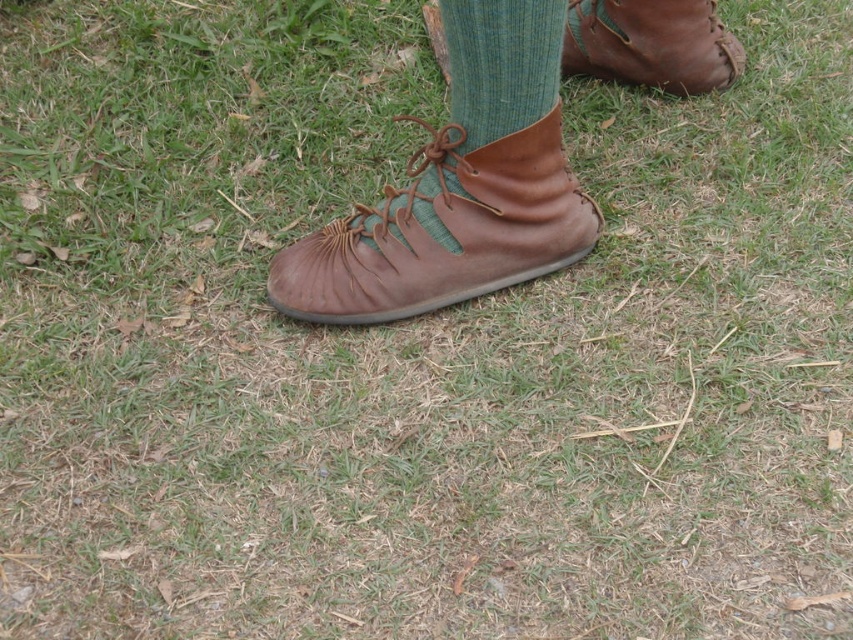
Who is more distant from viewer, (450, 300) or (500, 97)?

Positioned behind is point (450, 300).

Is point (358, 298) farther from viewer compared to point (517, 88)?

That is True.

I want to click on brown leather boot at center, so click(x=444, y=230).

Is brown leather boot at center positioned behind brown leather boot at upper right?

No, brown leather boot at center is in front of brown leather boot at upper right.

Between brown leather boot at center and brown leather boot at upper right, which one has less height?

Standing shorter between the two is brown leather boot at upper right.

Is point (366, 218) positioned after point (737, 44)?

No, (366, 218) is closer to viewer.

At what (x,y) coordinates should I click in order to perform the action: click on brown leather boot at center. Please return your answer as a coordinate pair (x, y). This screenshot has width=853, height=640. Looking at the image, I should click on (x=444, y=230).

Who is positioned more to the left, green knitted sock at center or brown leather boot at upper right?

green knitted sock at center

Does green knitted sock at center have a larger size compared to brown leather boot at upper right?

Yes, green knitted sock at center is bigger than brown leather boot at upper right.

Who is more distant from viewer, (521,4) or (685,19)?

The point (685,19) is more distant.

You are a GUI agent. You are given a task and a screenshot of the screen. Output one action in this format:
    pyautogui.click(x=<x>, y=<y>)
    Task: Click on the green knitted sock at center
    
    Given the screenshot: What is the action you would take?
    pos(502,64)